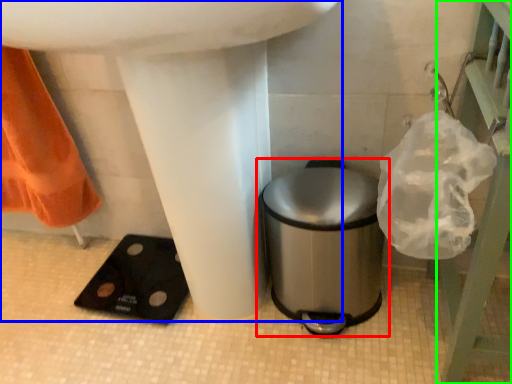
Question: Which object is positioned closest to waste container (highlighted by a red box)? Select from sink (highlighted by a blue box) and balustrade (highlighted by a green box).

Choices:
 (A) sink
 (B) balustrade

Answer: (A)